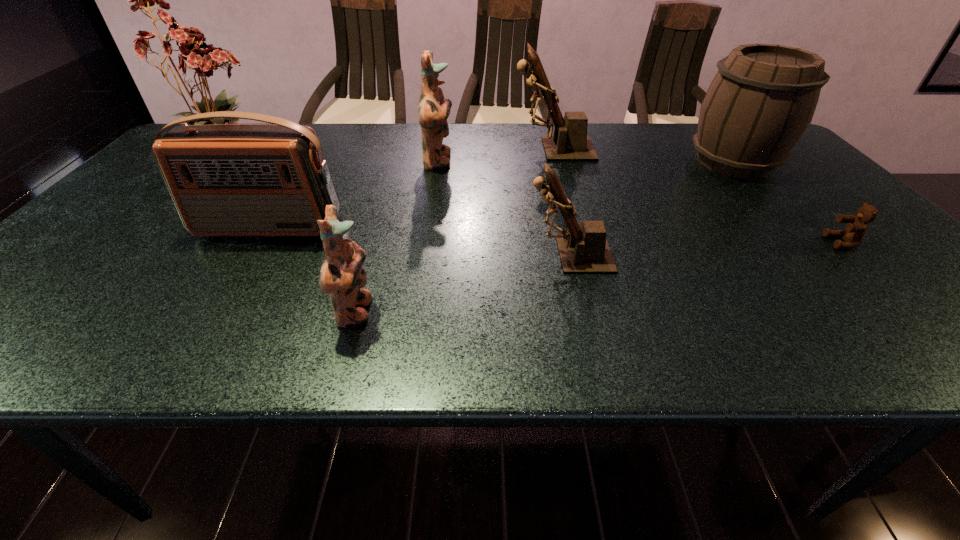
I want to click on the tallest object, so click(205, 60).

Identify the location of flower arrangement. (205, 60).

This screenshot has width=960, height=540. I want to click on the bigger brown figurine, so click(x=570, y=142).

Where is `the fifth object from right to left`? This screenshot has height=540, width=960. the fifth object from right to left is located at coordinates 434,109.

Find the location of a particular element. The height and width of the screenshot is (540, 960). the right pink figurine is located at coordinates (434, 109).

The width and height of the screenshot is (960, 540). Identify the location of wine bucket. (761, 101).

This screenshot has height=540, width=960. What are the coordinates of `radio receiver` in the screenshot? It's located at (226, 180).

Where is `the nearer brown figurine`? Image resolution: width=960 pixels, height=540 pixels. the nearer brown figurine is located at coordinates (585, 250).

The height and width of the screenshot is (540, 960). In order to click on the second nearest figurine in this screenshot , I will do `click(585, 250)`.

What are the coordinates of `the leftmost figurine` in the screenshot? It's located at (342, 275).